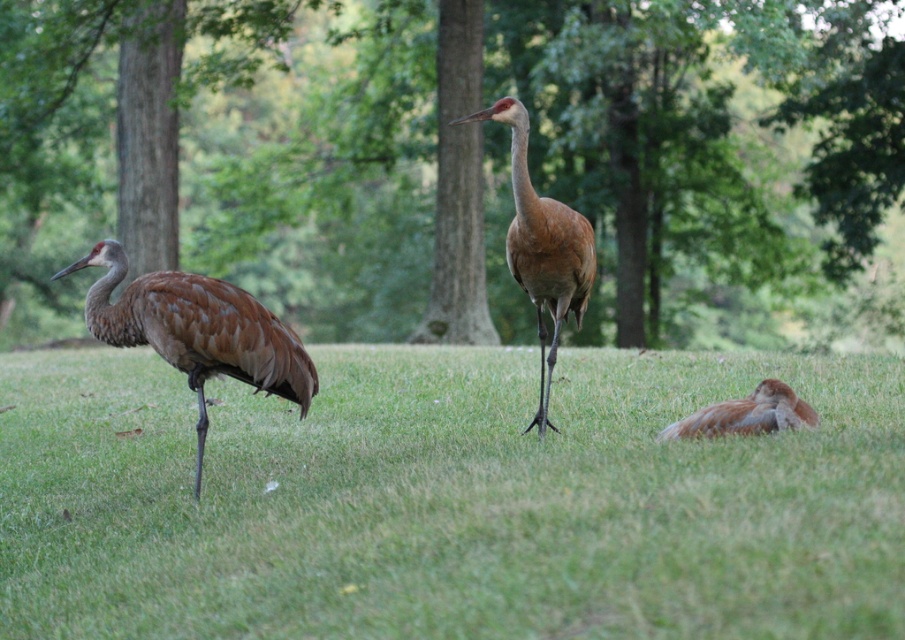
Question: Observing the image, what is the correct spatial positioning of green grass at center in reference to brown feathered bird at lower right?

Choices:
 (A) right
 (B) left

Answer: (B)

Question: Which point appears closest to the camera in this image?

Choices:
 (A) click(x=679, y=461)
 (B) click(x=775, y=380)

Answer: (A)

Question: From the image, what is the correct spatial relationship of brown textured tree at center in relation to brown feathered bird at lower right?

Choices:
 (A) left
 (B) right

Answer: (A)

Question: In this image, where is brown textured tree at center located relative to brown feathered crane at left?

Choices:
 (A) above
 (B) below

Answer: (A)

Question: Considering the real-world distances, which object is farthest from the brown textured tree at center?

Choices:
 (A) brown feathered crane at center
 (B) brown feathered bird at lower right

Answer: (B)

Question: Which object is farther from the camera taking this photo?

Choices:
 (A) brown feathered bird at lower right
 (B) brown feathered crane at center
 (C) brown feathered crane at left

Answer: (C)